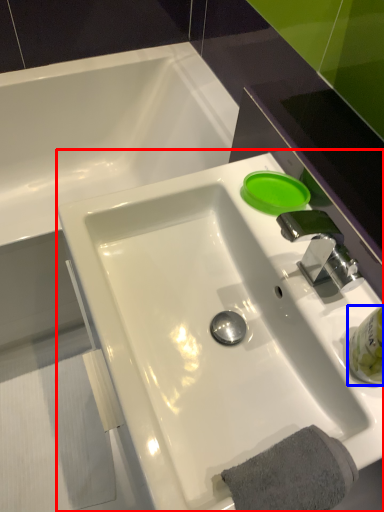
Question: Which object appears closest to the camera in this image, sink (highlighted by a red box) or liquid (highlighted by a blue box)?

Choices:
 (A) sink
 (B) liquid

Answer: (A)